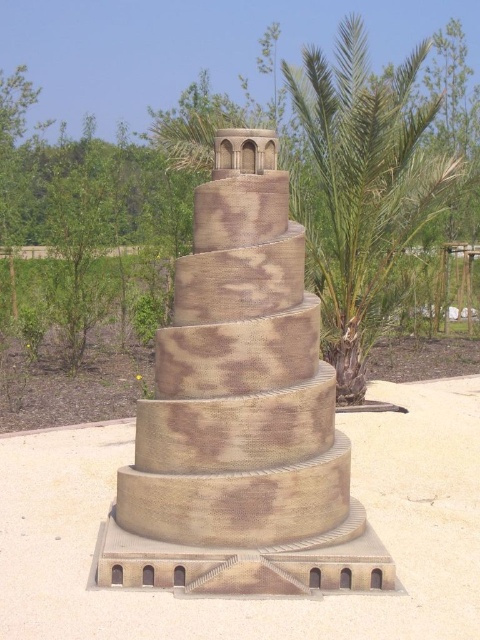
Where is the sandstone tower at center located in the image?

The sandstone tower at center is located at point (240, 413).

You are a visitor standing at the base of the Tower of Babel model. You see the beige textured sand at center and the green leafy palm tree at upper right. Which object is closer to the ground?

The beige textured sand at center is closer to the ground because it is located below the green leafy palm tree at upper right.

Looking at this image, you are standing in front of the Tower of Babel model and want to take a photo. You notice two points on the tower labeled as point 1 and point 2. Point 1 is at coordinates point [277,234] and point 2 is at point [422,132]. Which point will appear larger in your photo?

Point 1 at coordinates point [277,234] will appear larger in the photo because it is closer to the camera than point 2 at point [422,132].